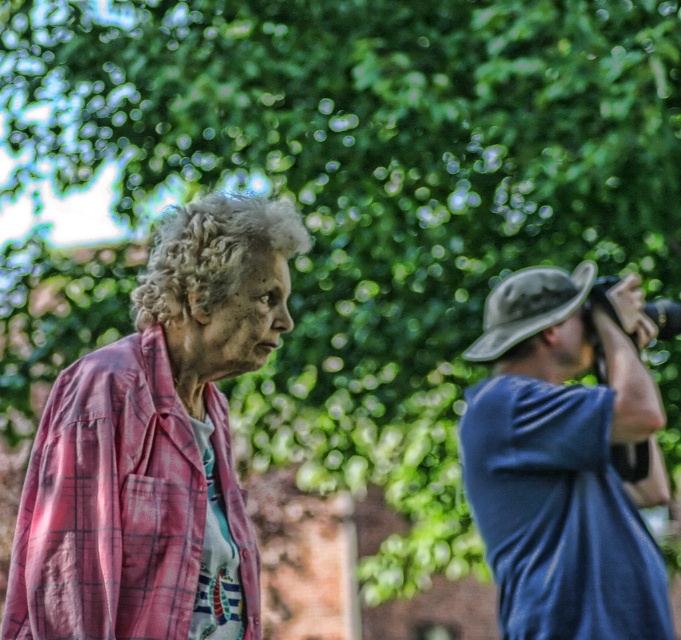
Question: Is pink plaid shirt at left further to camera compared to blue fabric hat at upper right?

Choices:
 (A) no
 (B) yes

Answer: (A)

Question: Does pink plaid shirt at left appear over blue fabric hat at upper right?

Choices:
 (A) no
 (B) yes

Answer: (B)

Question: Is pink plaid shirt at left positioned in front of blue fabric hat at upper right?

Choices:
 (A) no
 (B) yes

Answer: (B)

Question: Which point appears closest to the camera in this image?

Choices:
 (A) (507, 321)
 (B) (281, 285)

Answer: (B)